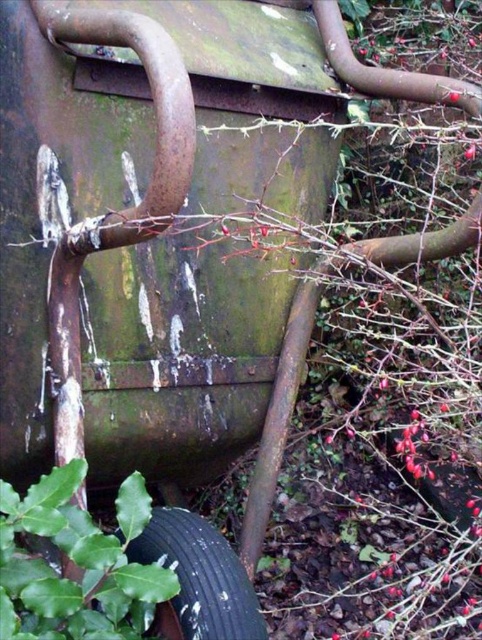
Question: Which point is closer to the camera taking this photo?

Choices:
 (A) click(x=108, y=579)
 (B) click(x=209, y=561)

Answer: (A)

Question: Does green leafy plant at lower left appear over black rubber tire at lower left?

Choices:
 (A) no
 (B) yes

Answer: (B)

Question: Which point is farther from the camera taking this photo?

Choices:
 (A) (198, 612)
 (B) (4, 515)

Answer: (A)

Question: Does green leafy plant at lower left have a smaller size compared to black rubber tire at lower left?

Choices:
 (A) no
 (B) yes

Answer: (A)

Question: Which object is farther from the camera taking this photo?

Choices:
 (A) black rubber tire at lower left
 (B) green leafy plant at lower left

Answer: (A)

Question: Does green leafy plant at lower left have a lesser width compared to black rubber tire at lower left?

Choices:
 (A) yes
 (B) no

Answer: (B)